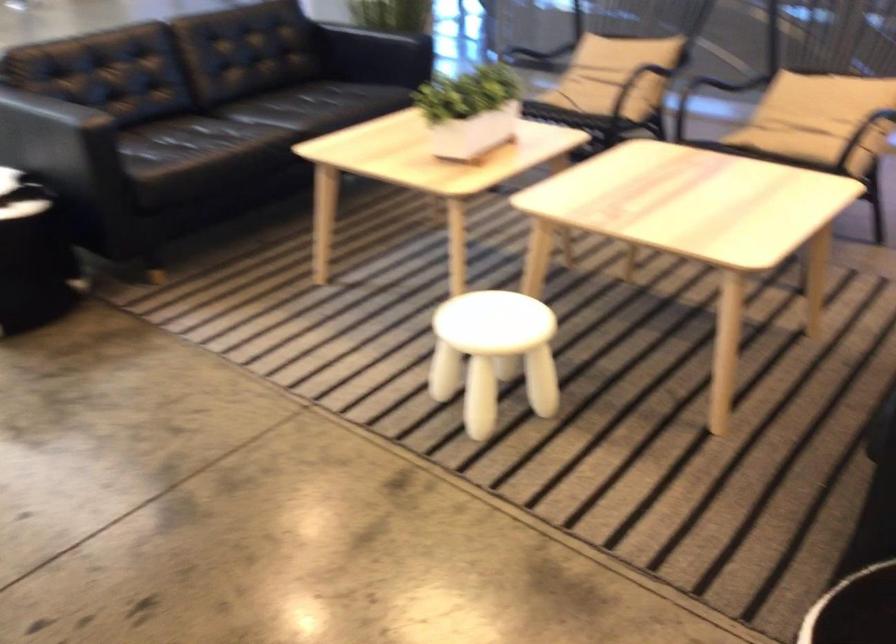
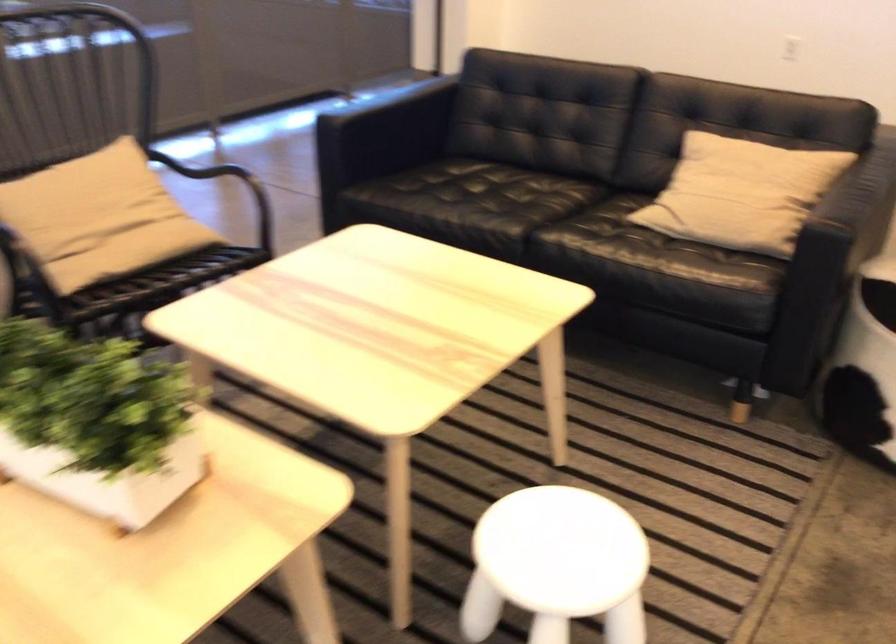
The point at (435, 100) is marked in the first image. Where is the corresponding point in the second image?

(96, 422)